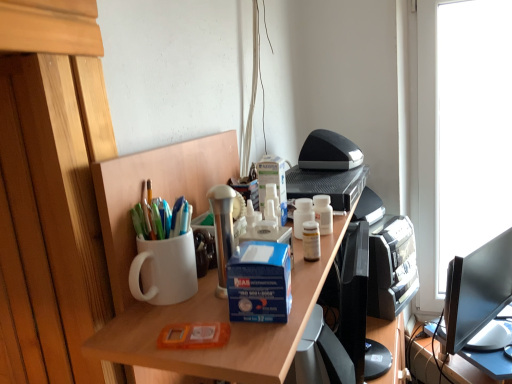
You are a GUI agent. You are given a task and a screenshot of the screen. Output one action in this format:
    pyautogui.click(x=<x>, y=<y>)
    Task: Click on the orange plastic case at center, arranged as the first stationery when ordered from the bottom
    
    Given the screenshot: What is the action you would take?
    pyautogui.click(x=194, y=336)

Could you tell me if orange plastic case at center, positioned as the 1th stationery in left-to-right order, is turned towards white matte desk at center?

No, orange plastic case at center, positioned as the 1th stationery in left-to-right order, is not turned towards white matte desk at center.

How many degrees apart are the facing directions of orange plastic case at center, positioned as the 1th stationery in left-to-right order, and white matte desk at center?

The facing directions of orange plastic case at center, positioned as the 1th stationery in left-to-right order, and white matte desk at center are 10.9 degrees apart.

Is orange plastic case at center, which is the 2th stationery from top to bottom, far away from white matte desk at center?

That's not correct — orange plastic case at center, which is the 2th stationery from top to bottom, is a little close to white matte desk at center.

Is orange plastic case at center, arranged as the first stationery when ordered from the bottom, inside the boundaries of white matte desk at center, or outside?

orange plastic case at center, arranged as the first stationery when ordered from the bottom, is not enclosed by white matte desk at center.

In the scene shown: Is the depth of white glossy bottle at upper center, the second stationery in the bottom-to-top sequence, less than that of orange plastic case at center, positioned as the 1th stationery in left-to-right order?

No, white glossy bottle at upper center, the second stationery in the bottom-to-top sequence, is behind orange plastic case at center, positioned as the 1th stationery in left-to-right order.

Between white glossy bottle at upper center, the second stationery from the front, and orange plastic case at center, the 2th stationery viewed from the right, which one appears on the right side from the viewer's perspective?

From the viewer's perspective, white glossy bottle at upper center, the second stationery from the front, appears more on the right side.

From a real-world perspective, is white glossy bottle at upper center, acting as the first stationery starting from the right, physically below orange plastic case at center, which is the 2th stationery from top to bottom?

Actually, white glossy bottle at upper center, acting as the first stationery starting from the right, is physically above orange plastic case at center, which is the 2th stationery from top to bottom, in the real world.

In terms of width, does blue cardboard box at center look wider or thinner when compared to white glossy bottle at upper center, which ranks as the 1th stationery in top-to-bottom order?

Considering their sizes, blue cardboard box at center looks broader than white glossy bottle at upper center, which ranks as the 1th stationery in top-to-bottom order.

Looking at this image, from the image's perspective, which is below, blue cardboard box at center or white glossy bottle at upper center, the second stationery in the bottom-to-top sequence?

blue cardboard box at center, from the image's perspective.

From a real-world perspective, is blue cardboard box at center located beneath white glossy bottle at upper center, acting as the first stationery starting from the right?

No.

Is white matte desk at center completely or partially inside white glossy bottle at upper center, the second stationery from the front?

No, white glossy bottle at upper center, the second stationery from the front, does not contain white matte desk at center.

From the white matte desk at center, count the 1st stationery to the left and point to it. Please provide its 2D coordinates.

[(323, 213)]

From a real-world perspective, which is physically below, white glossy bottle at upper center, the second stationery in the bottom-to-top sequence, or white matte desk at center?

white matte desk at center is physically lower.

Between white matte desk at center and blue cardboard box at center, which one appears on the left side from the viewer's perspective?

blue cardboard box at center is more to the left.

From the image's perspective, which one is positioned lower, white matte desk at center or blue cardboard box at center?

From the image's view, white matte desk at center is below.

Is white matte desk at center looking in the opposite direction of blue cardboard box at center?

No, white matte desk at center's orientation is not away from blue cardboard box at center.

Is white matte desk at center smaller than blue cardboard box at center?

No, white matte desk at center is not smaller than blue cardboard box at center.

From their relative heights in the image, would you say white glossy bottle at upper center, the 1th stationery when ordered from back to front, is taller or shorter than blue cardboard box at center?

Considering their sizes, white glossy bottle at upper center, the 1th stationery when ordered from back to front, has less height than blue cardboard box at center.

Which of these two, white glossy bottle at upper center, which ranks as the 1th stationery in top-to-bottom order, or blue cardboard box at center, is smaller?

With smaller size is white glossy bottle at upper center, which ranks as the 1th stationery in top-to-bottom order.

Which is behind, white glossy bottle at upper center, the second stationery in the bottom-to-top sequence, or blue cardboard box at center?

white glossy bottle at upper center, the second stationery in the bottom-to-top sequence, is further from the camera.

Is point (328, 208) positioned before point (262, 305)?

No.

Are white matte desk at center and orange plastic case at center, which is counted as the 1th stationery, starting from the front, far apart?

No, white matte desk at center is not far away from orange plastic case at center, which is counted as the 1th stationery, starting from the front.

Is white matte desk at center situated inside orange plastic case at center, which is the 2th stationery from top to bottom, or outside?

white matte desk at center is outside orange plastic case at center, which is the 2th stationery from top to bottom.

Considering the sizes of objects white matte desk at center and orange plastic case at center, the 2th stationery viewed from the right, in the image provided, who is thinner, white matte desk at center or orange plastic case at center, the 2th stationery viewed from the right,?

Thinner between the two is orange plastic case at center, the 2th stationery viewed from the right.

The height and width of the screenshot is (384, 512). What are the coordinates of `the 2nd stationery to the left of the white matte desk at center, counting from the anchor's position` in the screenshot? It's located at (194, 336).

You are a GUI agent. You are given a task and a screenshot of the screen. Output one action in this format:
    pyautogui.click(x=<x>, y=<y>)
    Task: Click on the stationery below the white glossy bottle at upper center, acting as the first stationery starting from the right (from the image's perspective)
    This screenshot has width=512, height=384.
    Given the screenshot: What is the action you would take?
    pyautogui.click(x=194, y=336)

When comparing their distances from orange plastic case at center, arranged as the first stationery when ordered from the bottom, does white matte desk at center or white glossy bottle at upper center, the second stationery in the bottom-to-top sequence, seem further?

white glossy bottle at upper center, the second stationery in the bottom-to-top sequence, lies further to orange plastic case at center, arranged as the first stationery when ordered from the bottom, than the other object.

Estimate the real-world distances between objects in this image. Which object is closer to white glossy bottle at upper center, which ranks as the 1th stationery in top-to-bottom order, blue cardboard box at center or orange plastic case at center, positioned as the second stationery in back-to-front order?

blue cardboard box at center is closer to white glossy bottle at upper center, which ranks as the 1th stationery in top-to-bottom order.

Considering their positions, is white matte desk at center positioned further to white glossy bottle at upper center, acting as the second stationery starting from the left, than orange plastic case at center, which is counted as the 1th stationery, starting from the front?

orange plastic case at center, which is counted as the 1th stationery, starting from the front, is positioned further to the anchor white glossy bottle at upper center, acting as the second stationery starting from the left.

Estimate the real-world distances between objects in this image. Which object is closer to white matte desk at center, orange plastic case at center, arranged as the first stationery when ordered from the bottom, or white glossy bottle at upper center, the 1th stationery when ordered from back to front?

The object closer to white matte desk at center is orange plastic case at center, arranged as the first stationery when ordered from the bottom.

Which object lies nearer to the anchor point white glossy bottle at upper center, which ranks as the 1th stationery in top-to-bottom order, orange plastic case at center, positioned as the 1th stationery in left-to-right order, or blue cardboard box at center?

The object closer to white glossy bottle at upper center, which ranks as the 1th stationery in top-to-bottom order, is blue cardboard box at center.

Looking at this image, considering their positions, is white glossy bottle at upper center, the second stationery from the front, positioned closer to orange plastic case at center, the 2th stationery viewed from the right, than white matte desk at center?

Based on the image, white matte desk at center appears to be nearer to orange plastic case at center, the 2th stationery viewed from the right.

Which object lies nearer to the anchor point white glossy bottle at upper center, acting as the second stationery starting from the left, orange plastic case at center, the 2th stationery viewed from the right, or white matte desk at center?

The object closer to white glossy bottle at upper center, acting as the second stationery starting from the left, is white matte desk at center.

Consider the image. Estimate the real-world distances between objects in this image. Which object is further from white matte desk at center, white glossy bottle at upper center, the second stationery in the bottom-to-top sequence, or orange plastic case at center, arranged as the first stationery when ordered from the bottom?

The object further to white matte desk at center is white glossy bottle at upper center, the second stationery in the bottom-to-top sequence.

Find the location of a particular element. The width and height of the screenshot is (512, 384). box positioned between orange plastic case at center, arranged as the first stationery when ordered from the bottom, and white glossy bottle at upper center, which ranks as the 1th stationery in top-to-bottom order, from near to far is located at coordinates (259, 282).

At what (x,y) coordinates should I click in order to perform the action: click on stationery between white glossy bottle at upper center, the second stationery from the front, and white matte desk at center vertically. Please return your answer as a coordinate pair (x, y). The height and width of the screenshot is (384, 512). Looking at the image, I should click on (194, 336).

Locate an element on the screen. The image size is (512, 384). stationery between blue cardboard box at center and white matte desk at center in the up-down direction is located at coordinates point(194,336).

The height and width of the screenshot is (384, 512). In order to click on box between white glossy bottle at upper center, acting as the first stationery starting from the right, and white matte desk at center vertically in this screenshot , I will do `click(259, 282)`.